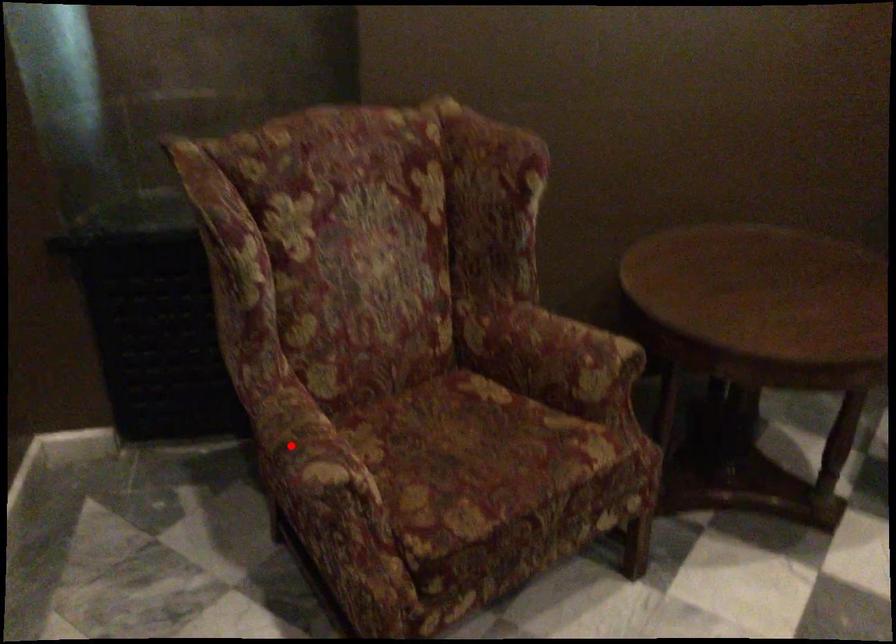
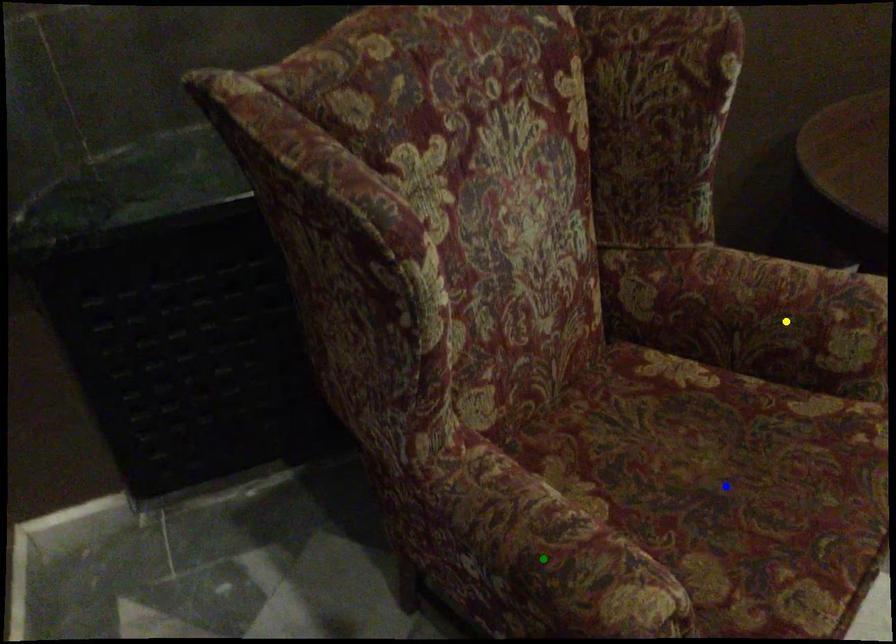
Question: I am providing you with two images of the same scene from different viewpoints. A red point is marked on the first image. You are given multiple points on the second image. Which point in image 2 represents the same 3d spot as the red point in image 1?

Choices:
 (A) green point
 (B) blue point
 (C) yellow point

Answer: (A)